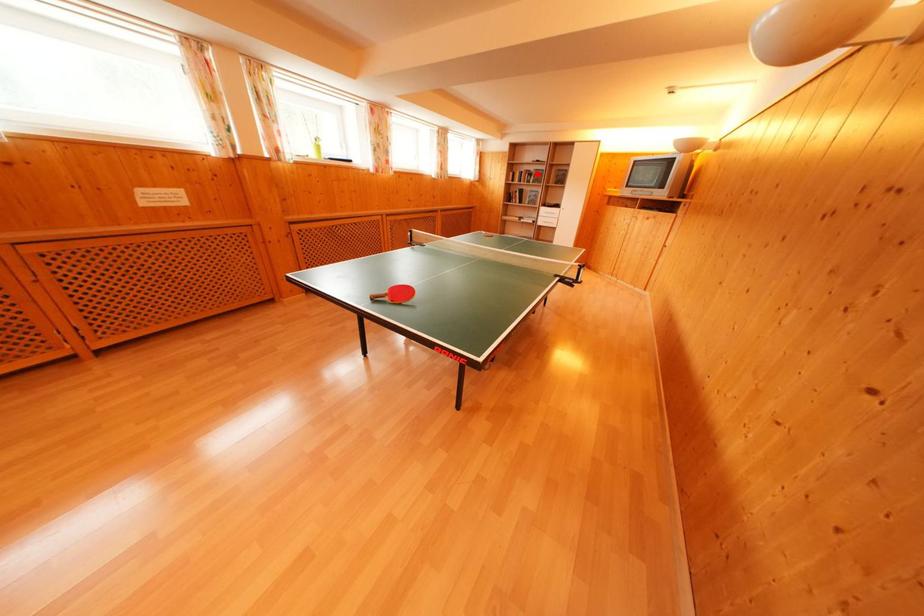
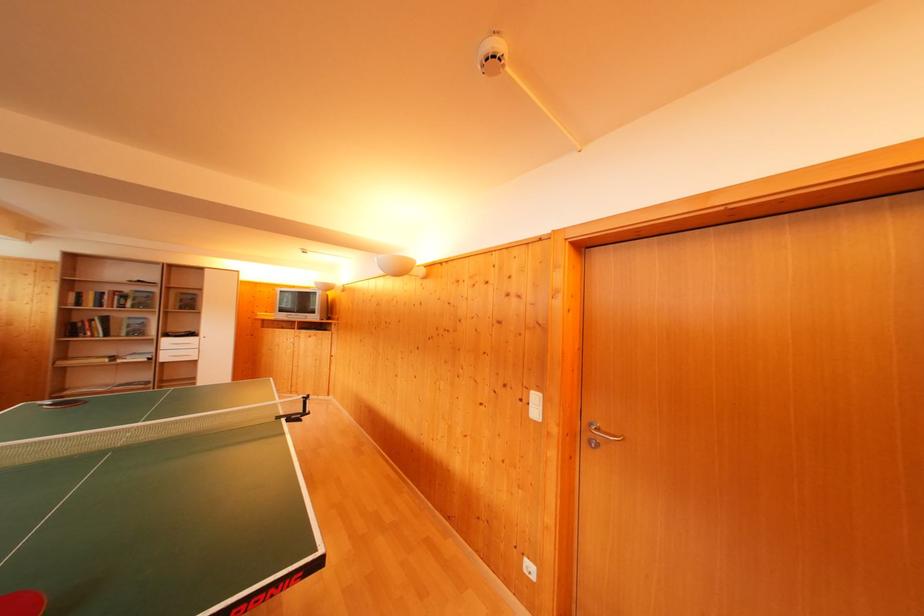
In the second image, find the point that corresponds to the highlighted location in the first image.

(131, 294)